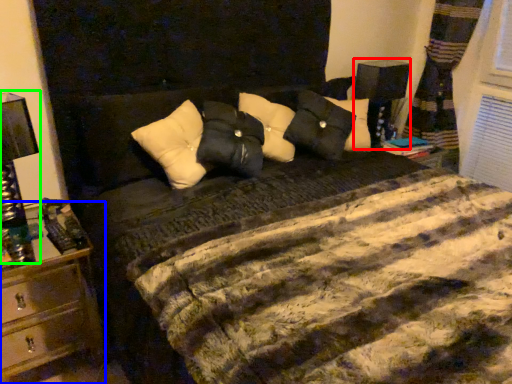
Question: Which object is positioned farthest from bedside lamp (highlighted by a red box)? Select from nightstand (highlighted by a blue box) and bedside lamp (highlighted by a green box).

Choices:
 (A) nightstand
 (B) bedside lamp

Answer: (B)